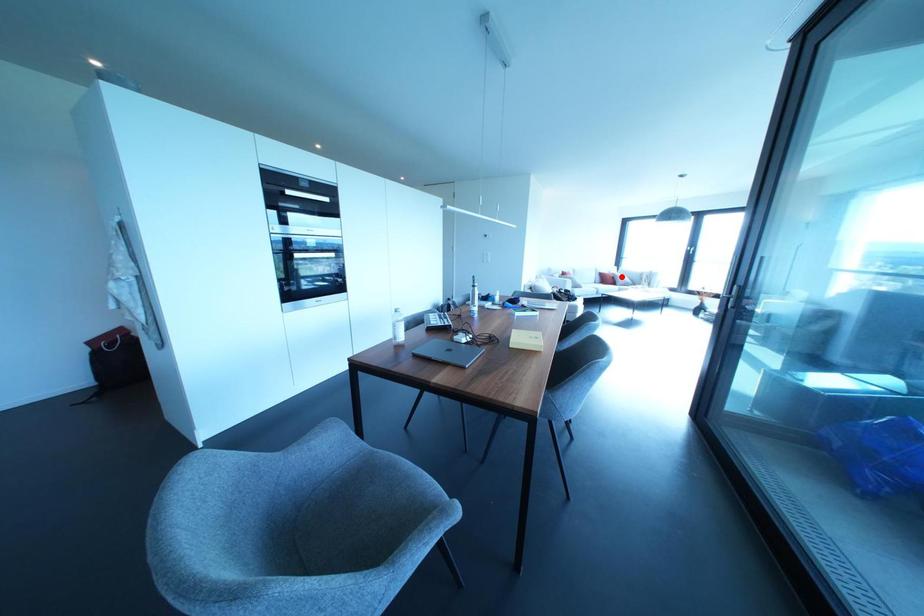
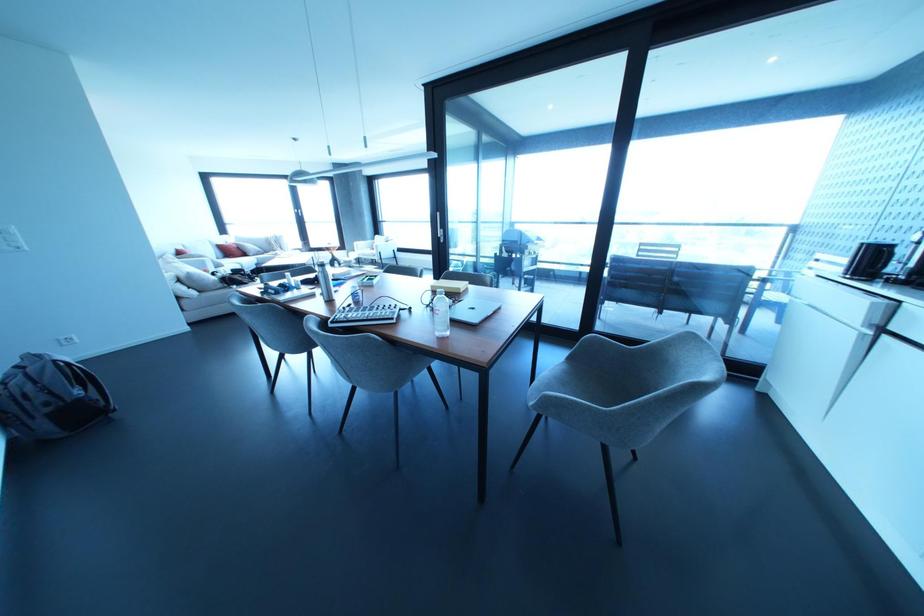
Question: I am providing you with two images of the same scene from different viewpoints. Given a red point in image1, look at the same physical point in image2. Is it:

Choices:
 (A) Closer to the viewpoint
 (B) Farther from the viewpoint

Answer: (B)